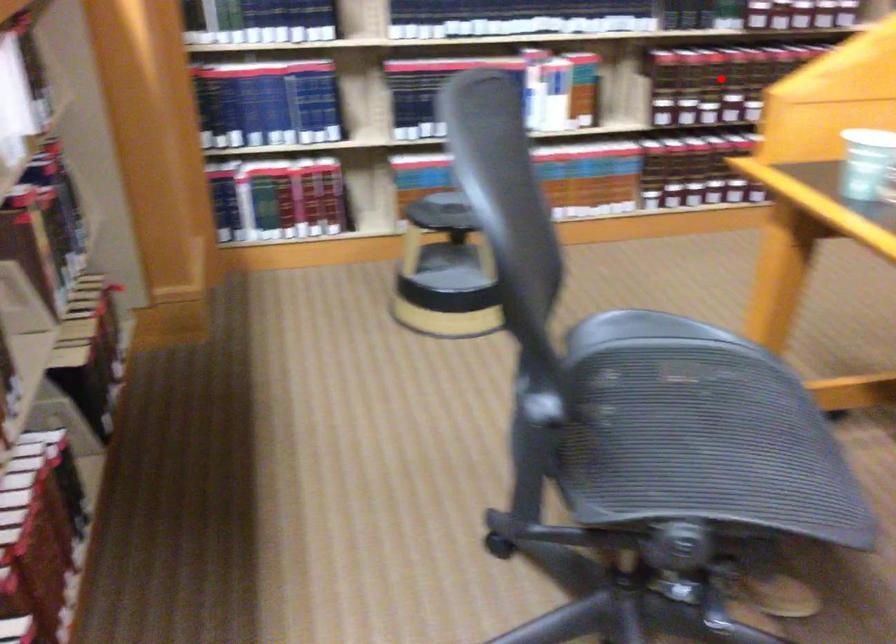
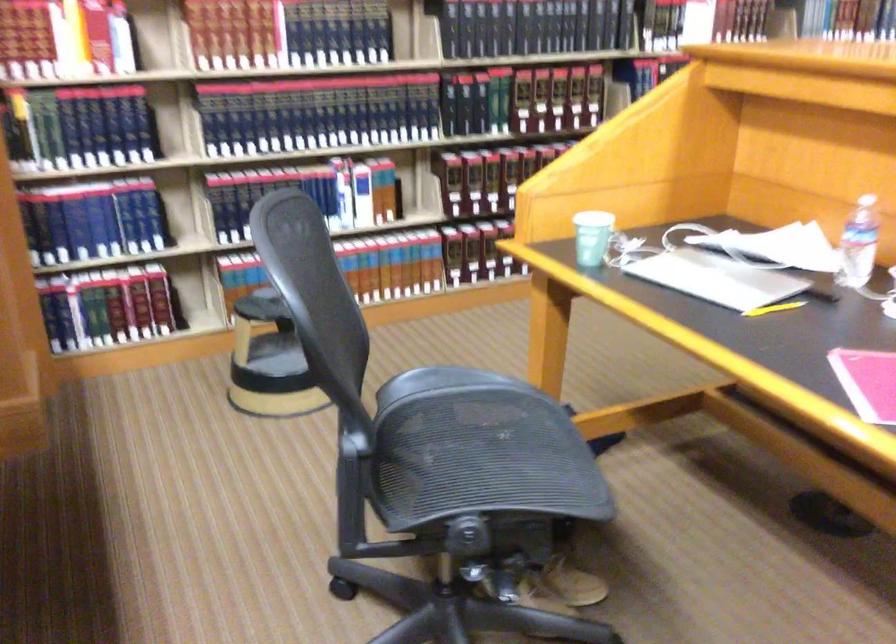
Question: I am providing you with two images of the same scene from different viewpoints. Image1 has a red point marked. In image2, the corresponding 3D location appears at what relative position? Reply with the corresponding letter.

Choices:
 (A) Closer
 (B) Farther

Answer: (B)